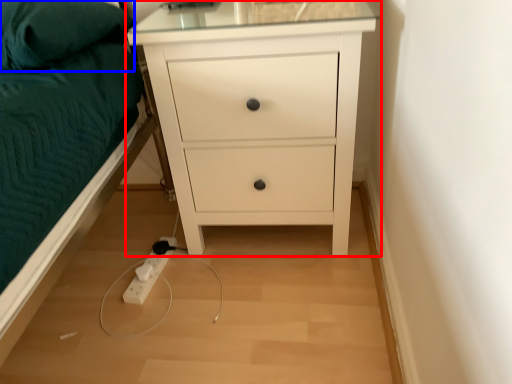
Question: Which point is further to the camera, chest of drawers (highlighted by a red box) or pillow (highlighted by a blue box)?

Choices:
 (A) chest of drawers
 (B) pillow

Answer: (A)